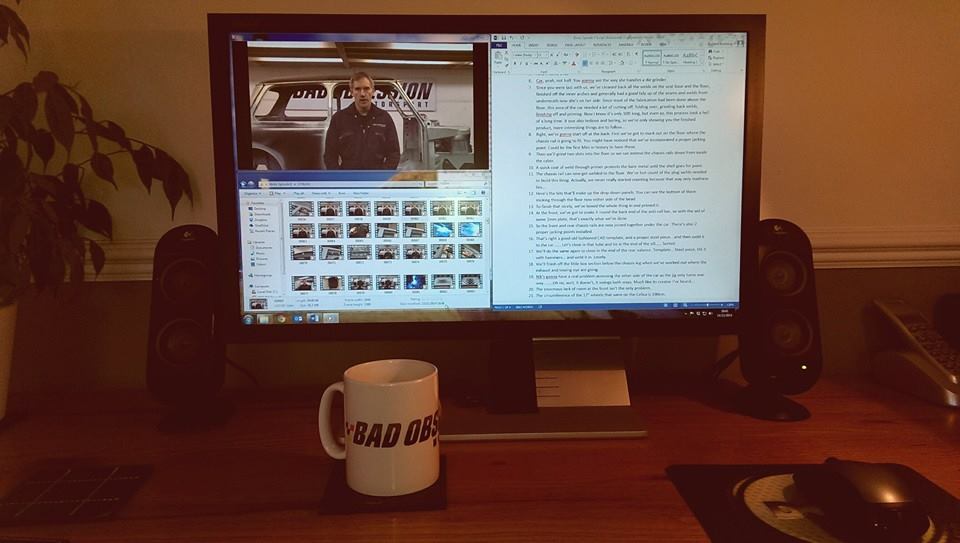
I want to click on computer mouse, so click(879, 486).